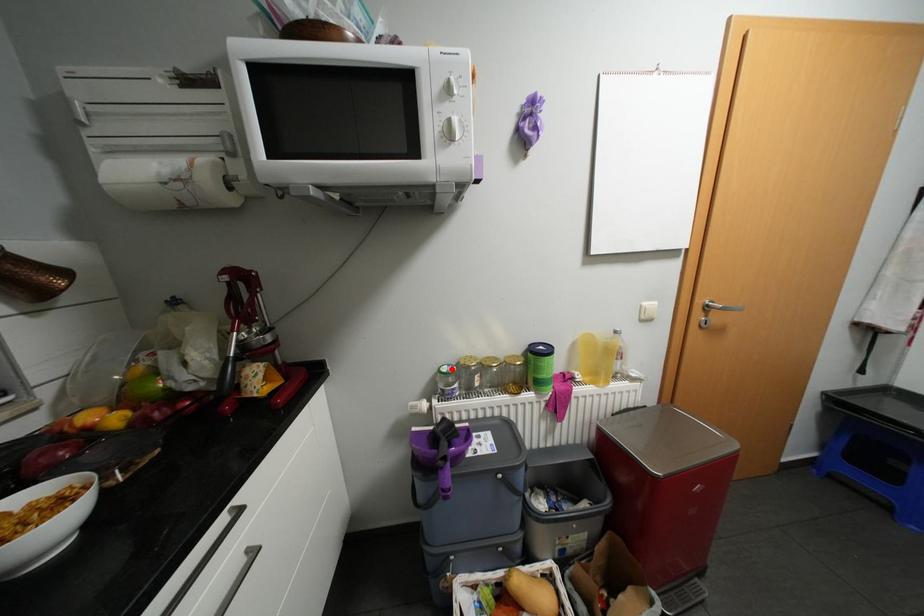
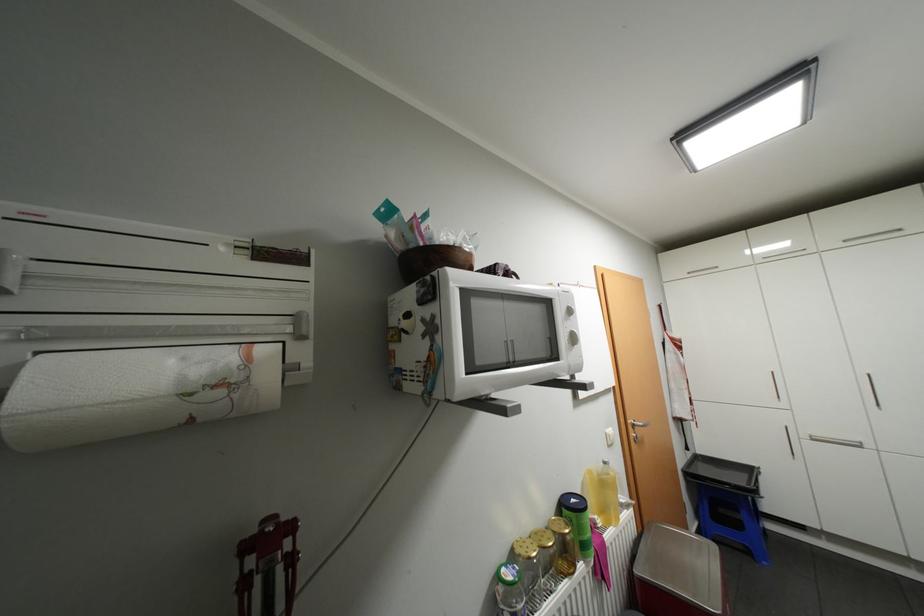
Find the pixel in the second image that matches the highlighted location in the first image.

(518, 576)